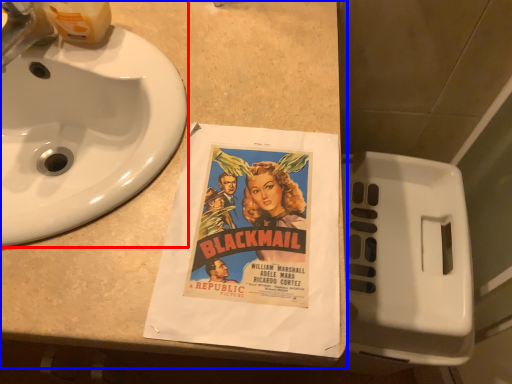
Question: Which object is further to the camera taking this photo, sink (highlighted by a red box) or counter top (highlighted by a blue box)?

Choices:
 (A) sink
 (B) counter top

Answer: (A)